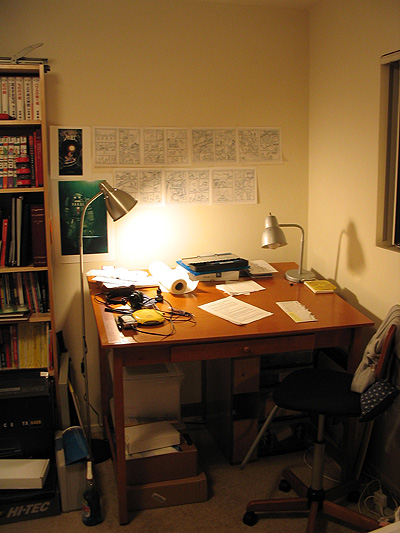
Locate an element on the screen. green poster on wall is located at coordinates (69, 196).